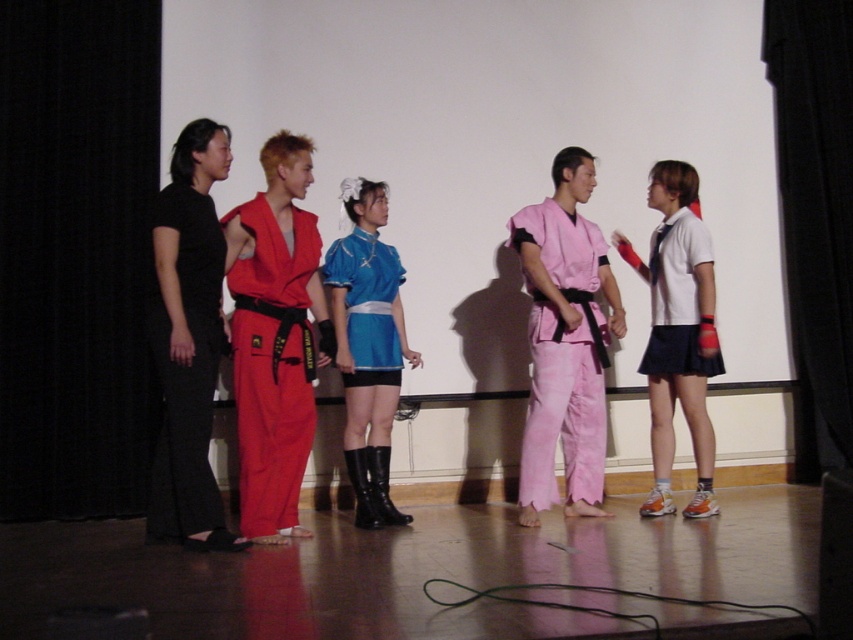
Looking at this image, who is positioned more to the right, white matte shirt at center or white matte shirt at right?

From the viewer's perspective, white matte shirt at right appears more on the right side.

In order to click on white matte shirt at center in this screenshot , I will do `click(677, 332)`.

Can you confirm if black matte pants at left is thinner than white matte shirt at right?

Indeed, black matte pants at left has a lesser width compared to white matte shirt at right.

Does black matte pants at left have a smaller size compared to white matte shirt at right?

Yes.

This screenshot has height=640, width=853. I want to click on black matte pants at left, so point(186,369).

Between white matte shirt at right and shiny blue fabric dress at center, which one appears on the left side from the viewer's perspective?

shiny blue fabric dress at center is more to the left.

Is point (701, 243) positioned behind point (370, 356)?

Yes, it is.

Locate an element on the screen. The image size is (853, 640). white matte shirt at right is located at coordinates (677, 298).